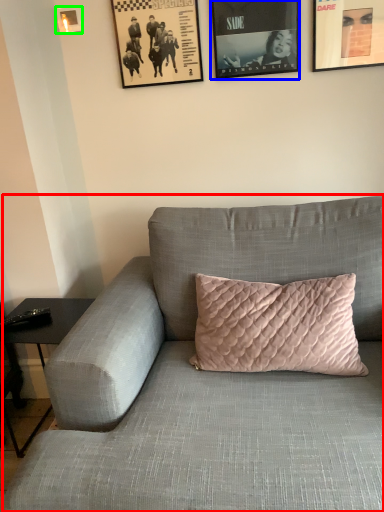
Question: Which object is positioned farthest from studio couch (highlighted by a red box)? Select from picture frame (highlighted by a blue box) and picture frame (highlighted by a green box).

Choices:
 (A) picture frame
 (B) picture frame

Answer: (B)